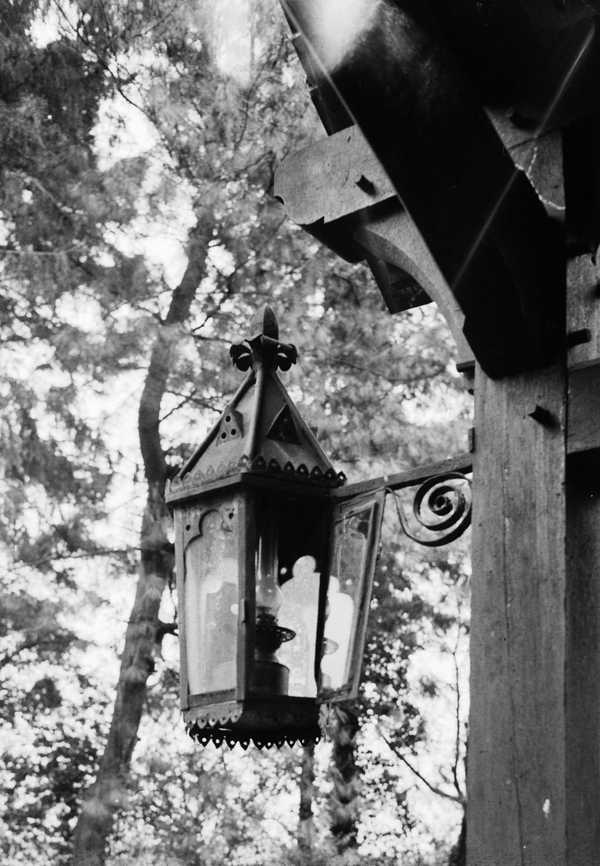
This screenshot has width=600, height=866. I want to click on top of lantern, so 263,308.